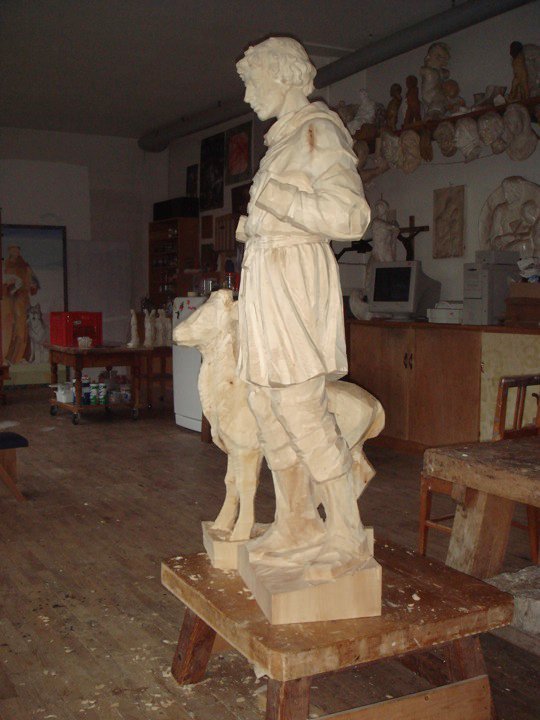
You are a GUI agent. You are given a task and a screenshot of the screen. Output one action in this format:
    pyautogui.click(x=<x>, y=<y>)
    Task: Click on the red plastic milk crate
    This screenshot has width=540, height=720.
    Given the screenshot: What is the action you would take?
    pyautogui.click(x=62, y=325)